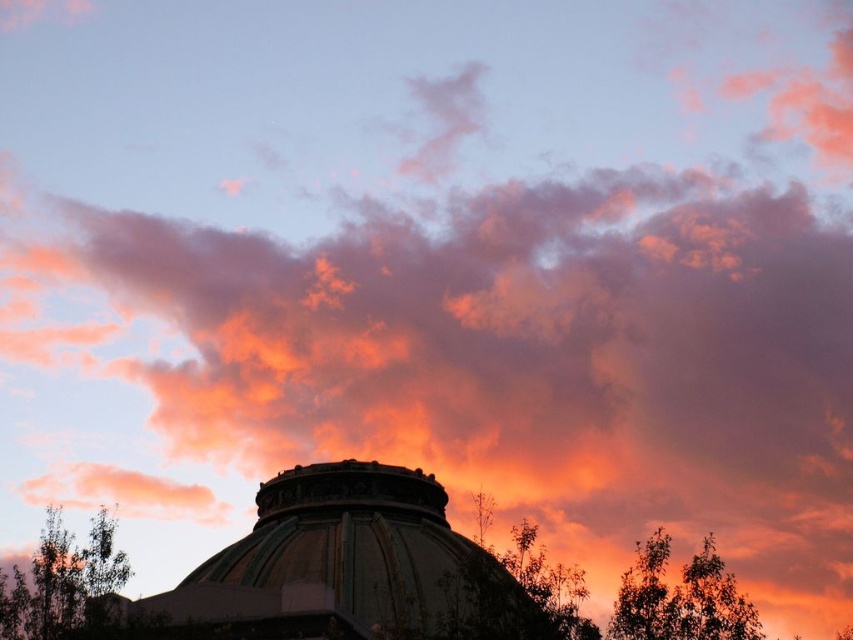
In the scene shown: Does metallic dome at center lie behind green leafy tree at lower left?

No, it is not.

Who is lower down, metallic dome at center or green leafy tree at lower left?

green leafy tree at lower left is below.

What do you see at coordinates (352, 564) in the screenshot?
I see `metallic dome at center` at bounding box center [352, 564].

This screenshot has height=640, width=853. I want to click on metallic dome at center, so click(352, 564).

From the picture: Is green leafy tree at lower left shorter than green leafy tree at right?

No.

Is point (25, 588) farther from viewer compared to point (631, 620)?

No, (25, 588) is in front of (631, 620).

In order to click on green leafy tree at lower left in this screenshot , I will do `click(62, 580)`.

Can you confirm if metallic dome at center is shorter than green leafy tree at right?

Indeed, metallic dome at center has a lesser height compared to green leafy tree at right.

Image resolution: width=853 pixels, height=640 pixels. What are the coordinates of `metallic dome at center` in the screenshot? It's located at (352, 564).

Where is `metallic dome at center`? metallic dome at center is located at coordinates (352, 564).

Identify the location of metallic dome at center. The width and height of the screenshot is (853, 640). (352, 564).